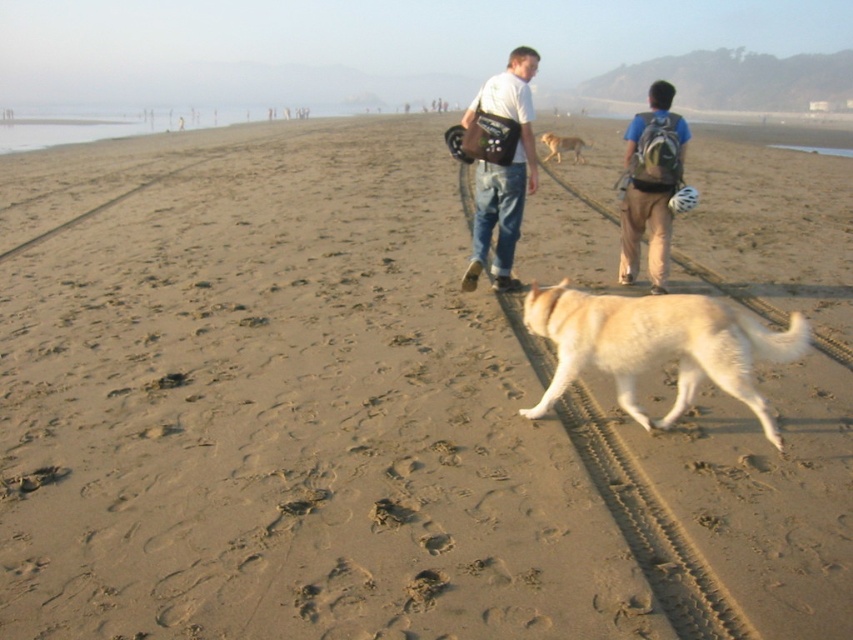
You are planning to take a walk with your dog on the beach. You have a matte brown backpack at right and a white fluffy dog at center. Which one should you carry first to ensure you can comfortably hold both while walking?

The matte brown backpack at right should be carried first since the white fluffy dog at center is larger in size and may require more space or attention.

You are a photographer trying to capture a photo of the white fluffy dog at center and the matte brown bag at center. Which object should you zoom in on more to ensure both are in focus?

The white fluffy dog at center has a lesser height compared to matte brown bag at center, so you should zoom in more on the white fluffy dog at center to ensure both are in focus.